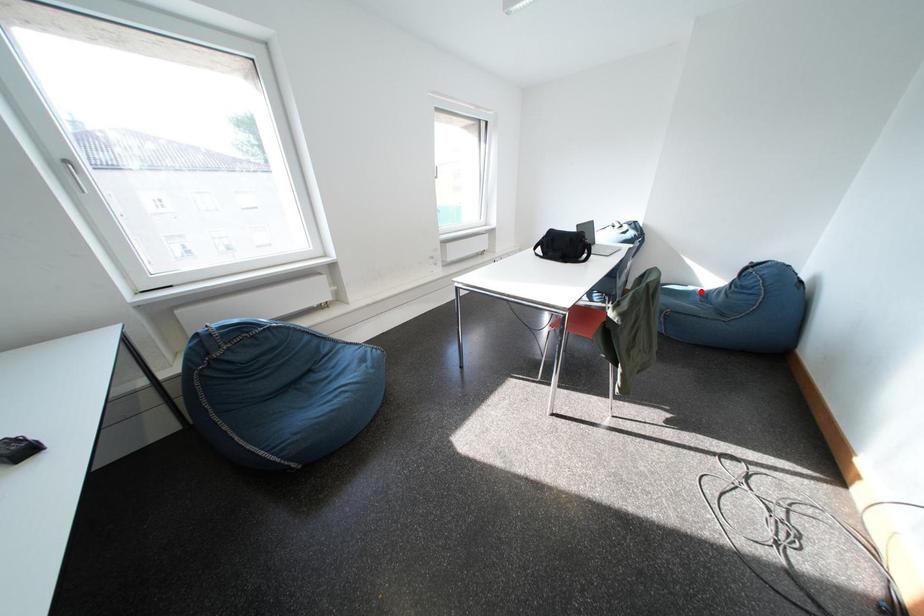
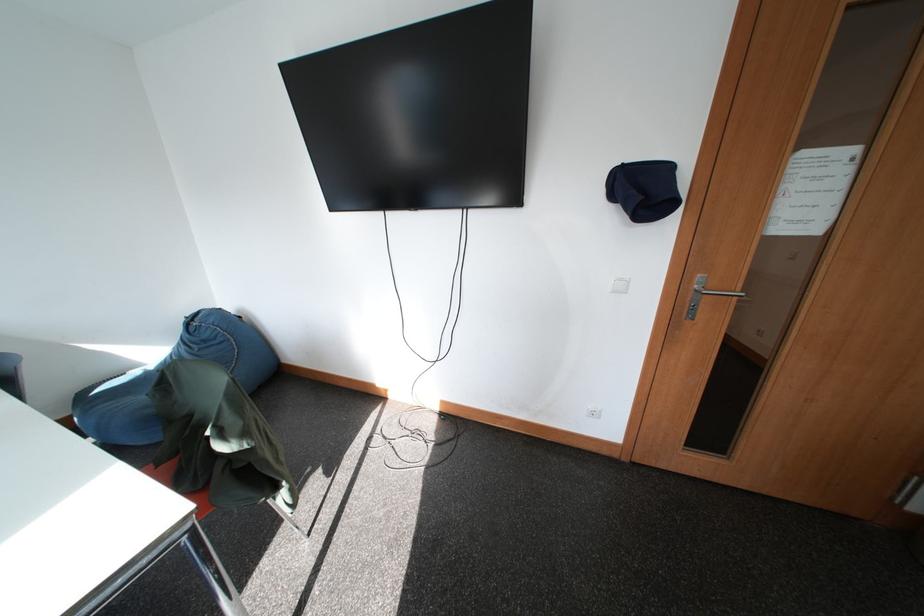
Question: I am providing you with two images of the same scene from different viewpoints. In image1, a red point is highlighted. Considering the same 3D point in image2, which of the following is correct?

Choices:
 (A) It is closer
 (B) It is farther

Answer: (A)